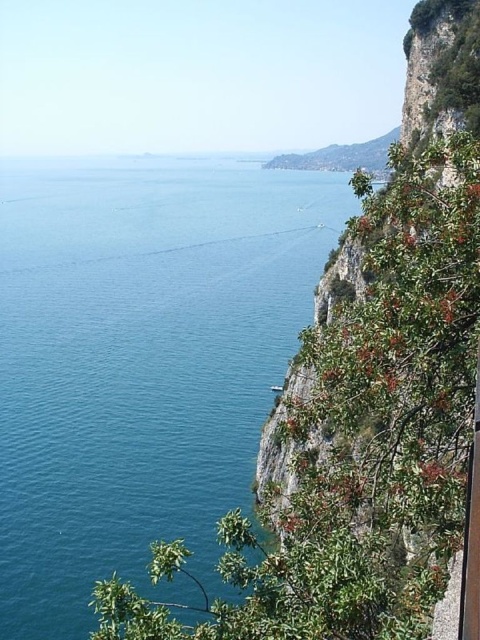
Question: Which object appears closest to the camera in this image?

Choices:
 (A) blue water at center
 (B) green leafy cliff at right

Answer: (B)

Question: Is blue water at center wider than green leafy cliff at right?

Choices:
 (A) no
 (B) yes

Answer: (B)

Question: Among these points, which one is nearest to the camera?

Choices:
 (A) (28, 278)
 (B) (410, 577)

Answer: (B)

Question: Can you confirm if blue water at center is bigger than green leafy cliff at right?

Choices:
 (A) yes
 (B) no

Answer: (A)

Question: Is blue water at center bigger than green leafy cliff at right?

Choices:
 (A) no
 (B) yes

Answer: (B)

Question: Which of the following is the closest to the observer?

Choices:
 (A) (203, 280)
 (B) (250, 570)

Answer: (B)